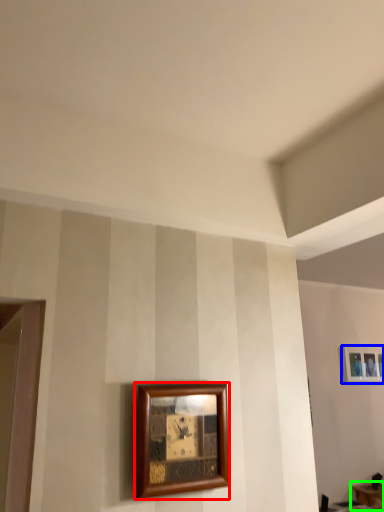
Question: Considering the real-world distances, which object is closest to picture frame (highlighted by a red box)? picture frame (highlighted by a blue box) or table (highlighted by a green box).

Choices:
 (A) picture frame
 (B) table

Answer: (A)